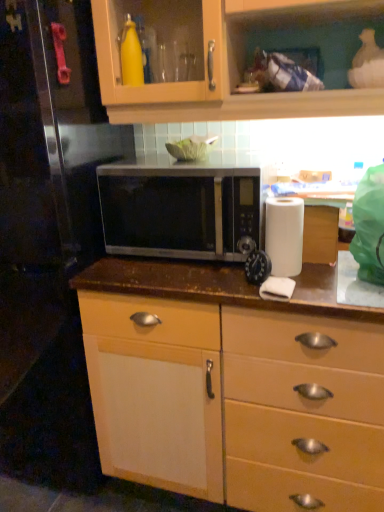
Find the location of a particular element. vacant space situated on the left part of black plastic clock at center is located at coordinates (204, 279).